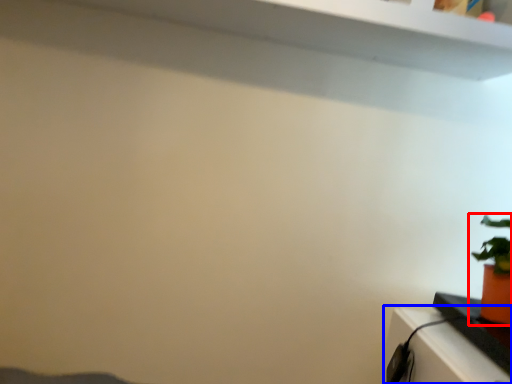
Question: Which of the following is the closest to the observer, houseplant (highlighted by a red box) or table (highlighted by a blue box)?

Choices:
 (A) houseplant
 (B) table

Answer: (B)